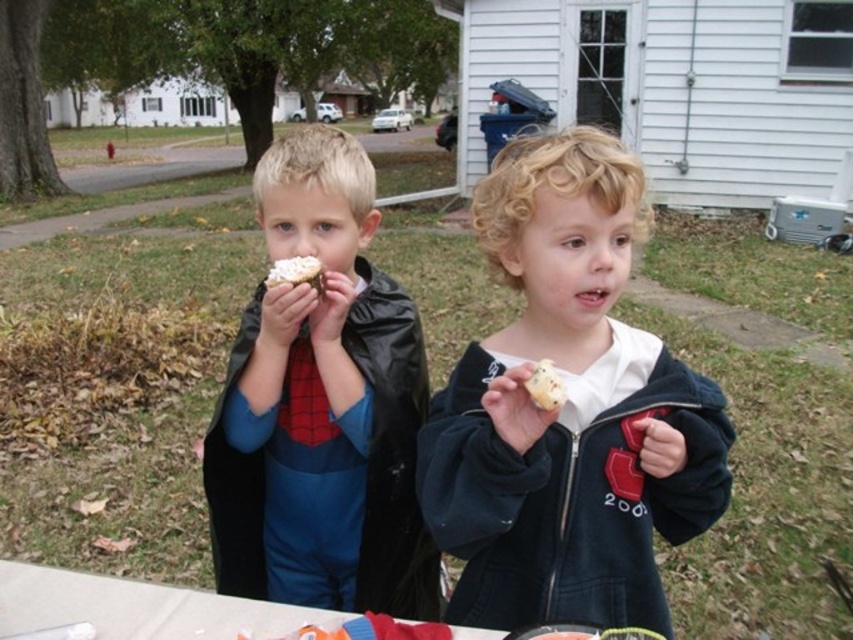
Which of these two, matte black cape at left or white fluffy cupcake at center, stands taller?

Standing taller between the two is matte black cape at left.

Measure the distance between matte black cape at left and camera.

matte black cape at left is 1.15 meters from camera.

Is point (283, 468) positioned behind point (549, 376)?

Yes, point (283, 468) is farther from viewer.

Where is `matte black cape at left`? The height and width of the screenshot is (640, 853). matte black cape at left is located at coordinates (321, 404).

Is point (4, 625) closer to viewer compared to point (541, 362)?

No, it is not.

Locate an element on the screen. Image resolution: width=853 pixels, height=640 pixels. white plastic table at lower center is located at coordinates (135, 605).

Is matte black jacket at center shorter than white plastic table at lower center?

No.

Does matte black jacket at center have a larger size compared to white plastic table at lower center?

Indeed, matte black jacket at center has a larger size compared to white plastic table at lower center.

The height and width of the screenshot is (640, 853). What do you see at coordinates (567, 410) in the screenshot?
I see `matte black jacket at center` at bounding box center [567, 410].

You are a GUI agent. You are given a task and a screenshot of the screen. Output one action in this format:
    pyautogui.click(x=<x>, y=<y>)
    Task: Click on the matte black jacket at center
    
    Given the screenshot: What is the action you would take?
    pyautogui.click(x=567, y=410)